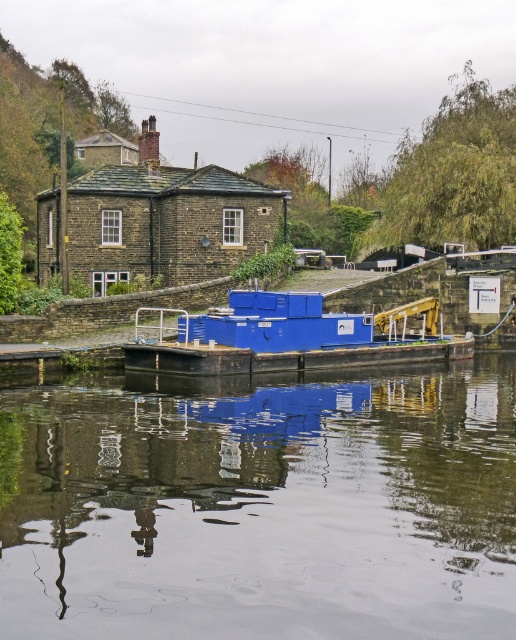
You are standing at the riverside and want to take a photo of the smooth reflective water at center. According to the scene description, where exactly is the smooth reflective water located in the image?

The smooth reflective water at center is located at point (262, 506).

You are standing at the riverside and want to take a photo of both the point at coordinates point (x=135, y=595) and the point at coordinates point (x=337, y=337). Which point will appear larger in your camera view?

Point (x=135, y=595) is closer to the camera than point (x=337, y=337), so it will appear larger in the photo.